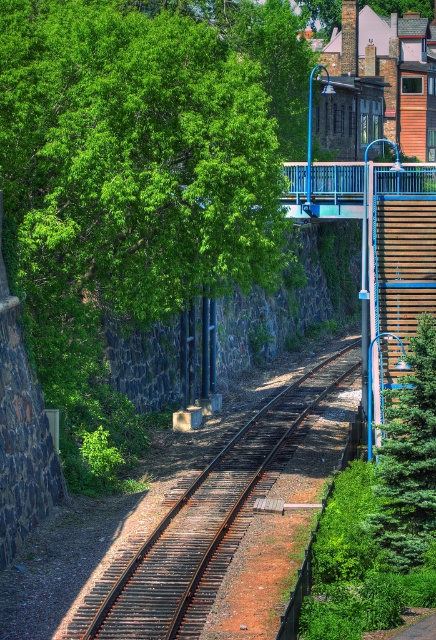
Question: Which object is farther from the camera taking this photo?

Choices:
 (A) green textured evergreen at right
 (B) green leafy tree at upper left
 (C) rusty metal train track at center

Answer: (B)

Question: Can you confirm if rusty metal train track at center is positioned to the right of green textured evergreen at right?

Choices:
 (A) yes
 (B) no

Answer: (B)

Question: Which point is farther to the camera?

Choices:
 (A) rusty metal train track at center
 (B) green textured evergreen at right

Answer: (B)

Question: Which point is farther to the camera?

Choices:
 (A) green textured evergreen at right
 (B) green leafy tree at upper left

Answer: (B)

Question: Does rusty metal train track at center have a lesser width compared to green textured evergreen at right?

Choices:
 (A) no
 (B) yes

Answer: (A)

Question: Is rusty metal train track at center to the left of green textured evergreen at right from the viewer's perspective?

Choices:
 (A) yes
 (B) no

Answer: (A)